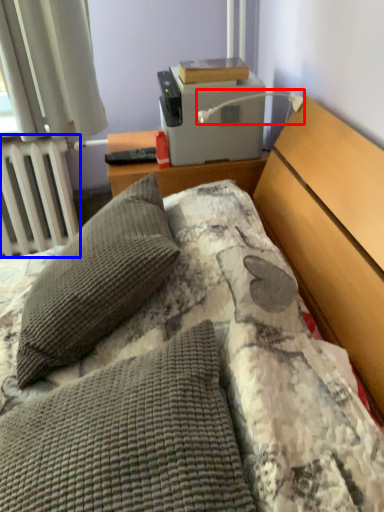
Question: Which object appears closest to the camera in this image, lamp (highlighted by a red box) or radiator (highlighted by a blue box)?

Choices:
 (A) lamp
 (B) radiator

Answer: (A)